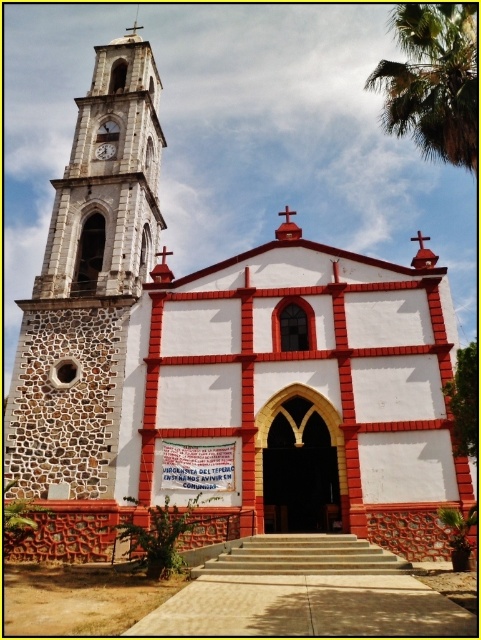
Question: Is stone clock tower at left positioned at the back of metallic clock at left?

Choices:
 (A) no
 (B) yes

Answer: (A)

Question: Which point appears farthest from the camera in this image?

Choices:
 (A) (476, 154)
 (B) (64, 426)

Answer: (B)

Question: In this image, where is stone clock tower at left located relative to green leafy palm tree at upper right?

Choices:
 (A) above
 (B) below

Answer: (B)

Question: Considering the relative positions of green leafy palm tree at upper right and metallic clock at left in the image provided, where is green leafy palm tree at upper right located with respect to metallic clock at left?

Choices:
 (A) below
 (B) above

Answer: (B)

Question: Considering the real-world distances, which object is closest to the green leafy palm tree at upper right?

Choices:
 (A) stone clock tower at left
 (B) metallic clock at left

Answer: (A)

Question: Which object is closer to the camera taking this photo?

Choices:
 (A) green leafy palm tree at upper right
 (B) metallic clock at left
 (C) stone clock tower at left

Answer: (A)